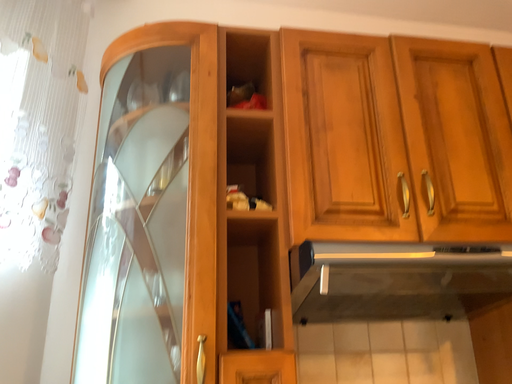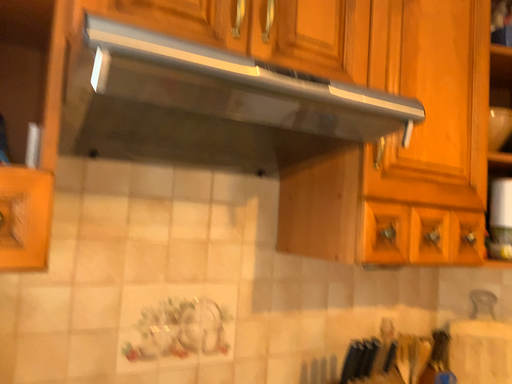
Question: Which way did the camera rotate in the video?

Choices:
 (A) rotated left
 (B) rotated right

Answer: (B)